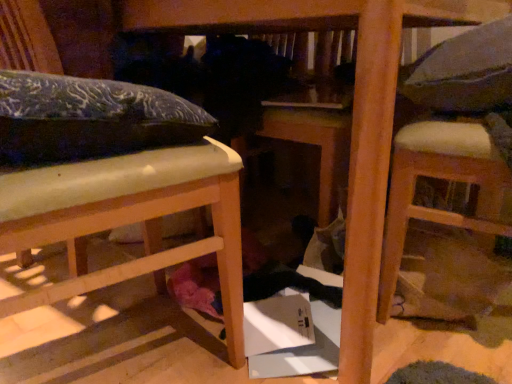
Identify the location of matte blue pillow at upper left. (89, 118).

Based on the photo, what is the approximate height of white padded chair at right, the 2th furniture viewed from the left?

white padded chair at right, the 2th furniture viewed from the left, is 27.96 inches in height.

What is the approximate height of matte wood bed at left, the 2th furniture when ordered from right to left?

It is 70.19 centimeters.

Find the location of `matte blue pillow at upper left`. matte blue pillow at upper left is located at coordinates (89, 118).

Between white padded chair at right, the 2th furniture viewed from the left, and matte wood bed at left, the 2th furniture when ordered from right to left, which one has smaller size?

white padded chair at right, the 2th furniture viewed from the left, is smaller.

From the image's perspective, would you say white padded chair at right, marked as the 1th furniture in a right-to-left arrangement, is positioned over matte wood bed at left, the first furniture positioned from the left?

Yes.

Is white padded chair at right, the 2th furniture viewed from the left, facing towards matte wood bed at left, the 2th furniture when ordered from right to left?

No, white padded chair at right, the 2th furniture viewed from the left, is not facing towards matte wood bed at left, the 2th furniture when ordered from right to left.

Is white padded chair at right, marked as the 1th furniture in a right-to-left arrangement, directly adjacent to matte wood bed at left, the first furniture positioned from the left?

white padded chair at right, marked as the 1th furniture in a right-to-left arrangement, and matte wood bed at left, the first furniture positioned from the left, are not in contact.

How many degrees apart are the facing directions of matte blue pillow at upper left and matte wood bed at left, the first furniture positioned from the left?

94.8 degrees separate the facing orientations of matte blue pillow at upper left and matte wood bed at left, the first furniture positioned from the left.

Locate an element on the screen. leftover that is above the matte wood bed at left, the 2th furniture when ordered from right to left (from the image's perspective) is located at coordinates (89, 118).

From a real-world perspective, is matte blue pillow at upper left positioned above or below matte wood bed at left, the 2th furniture when ordered from right to left?

Clearly, from a real-world perspective, matte blue pillow at upper left is above matte wood bed at left, the 2th furniture when ordered from right to left.

Between matte blue pillow at upper left and matte wood bed at left, the 2th furniture when ordered from right to left, which one has smaller width?

With smaller width is matte blue pillow at upper left.

Could you tell me if matte wood bed at left, the first furniture positioned from the left, is facing gray fabric pillow at upper right?

Yes.

Looking at this image, which object is wider, matte wood bed at left, the 2th furniture when ordered from right to left, or gray fabric pillow at upper right?

matte wood bed at left, the 2th furniture when ordered from right to left, is wider.

Between matte wood bed at left, the 2th furniture when ordered from right to left, and gray fabric pillow at upper right, which one has less height?

With less height is gray fabric pillow at upper right.

Is there a large distance between matte wood bed at left, the 2th furniture when ordered from right to left, and gray fabric pillow at upper right?

That's not correct — matte wood bed at left, the 2th furniture when ordered from right to left, is a little close to gray fabric pillow at upper right.

Does matte blue pillow at upper left appear on the right side of gray fabric pillow at upper right?

In fact, matte blue pillow at upper left is to the left of gray fabric pillow at upper right.

In the image, is matte blue pillow at upper left positioned in front of or behind gray fabric pillow at upper right?

matte blue pillow at upper left is in front of gray fabric pillow at upper right.

Is matte blue pillow at upper left turned away from gray fabric pillow at upper right?

That's not correct — matte blue pillow at upper left is not looking away from gray fabric pillow at upper right.

In terms of width, does matte blue pillow at upper left look wider or thinner when compared to gray fabric pillow at upper right?

matte blue pillow at upper left is wider than gray fabric pillow at upper right.

Are matte wood bed at left, the first furniture positioned from the left, and matte blue pillow at upper left located far from each other?

No, matte wood bed at left, the first furniture positioned from the left, is not far from matte blue pillow at upper left.

From the image's perspective, which one is positioned lower, matte wood bed at left, the first furniture positioned from the left, or matte blue pillow at upper left?

From the image's view, matte wood bed at left, the first furniture positioned from the left, is below.

Does matte wood bed at left, the 2th furniture when ordered from right to left, turn towards matte blue pillow at upper left?

Yes, matte wood bed at left, the 2th furniture when ordered from right to left, is oriented towards matte blue pillow at upper left.

Locate an element on the screen. This screenshot has width=512, height=384. furniture on the left of matte blue pillow at upper left is located at coordinates (114, 179).

How different are the orientations of white padded chair at right, the 2th furniture viewed from the left, and gray fabric pillow at upper right in degrees?

The facing directions of white padded chair at right, the 2th furniture viewed from the left, and gray fabric pillow at upper right are 6.39 degrees apart.

Is point (471, 144) farther from camera compared to point (405, 93)?

No.

In the scene shown: Between white padded chair at right, marked as the 1th furniture in a right-to-left arrangement, and gray fabric pillow at upper right, which one has smaller size?

gray fabric pillow at upper right is smaller.

Is white padded chair at right, the 2th furniture viewed from the left, at the left side of gray fabric pillow at upper right?

In fact, white padded chair at right, the 2th furniture viewed from the left, is to the right of gray fabric pillow at upper right.

Is white padded chair at right, marked as the 1th furniture in a right-to-left arrangement, inside or outside of matte blue pillow at upper left?

white padded chair at right, marked as the 1th furniture in a right-to-left arrangement, is outside matte blue pillow at upper left.

How many degrees apart are the facing directions of white padded chair at right, marked as the 1th furniture in a right-to-left arrangement, and matte blue pillow at upper left?

161 degrees.

You are a GUI agent. You are given a task and a screenshot of the screen. Output one action in this format:
    pyautogui.click(x=<x>, y=<y>)
    Task: Click on the leftover to the left of white padded chair at right, marked as the 1th furniture in a right-to-left arrangement
    
    Given the screenshot: What is the action you would take?
    pyautogui.click(x=89, y=118)

Is white padded chair at right, the 2th furniture viewed from the left, in front of or behind matte blue pillow at upper left in the image?

In the image, white padded chair at right, the 2th furniture viewed from the left, appears behind matte blue pillow at upper left.

Image resolution: width=512 pixels, height=384 pixels. Find the location of `furniture in front of the white padded chair at right, the 2th furniture viewed from the left`. furniture in front of the white padded chair at right, the 2th furniture viewed from the left is located at coordinates (114, 179).

The image size is (512, 384). There is a matte wood bed at left, the first furniture positioned from the left. In order to click on leftover above it (from a real-world perspective) in this screenshot , I will do click(x=89, y=118).

Based on their spatial positions, is matte blue pillow at upper left or gray fabric pillow at upper right closer to white padded chair at right, the 2th furniture viewed from the left?

Based on the image, gray fabric pillow at upper right appears to be nearer to white padded chair at right, the 2th furniture viewed from the left.

From the picture: Estimate the real-world distances between objects in this image. Which object is closer to matte blue pillow at upper left, white padded chair at right, the 2th furniture viewed from the left, or gray fabric pillow at upper right?

The object closer to matte blue pillow at upper left is white padded chair at right, the 2th furniture viewed from the left.

Estimate the real-world distances between objects in this image. Which object is closer to matte wood bed at left, the 2th furniture when ordered from right to left, white padded chair at right, marked as the 1th furniture in a right-to-left arrangement, or matte blue pillow at upper left?

matte blue pillow at upper left lies closer to matte wood bed at left, the 2th furniture when ordered from right to left, than the other object.

Looking at the image, which one is located closer to white padded chair at right, the 2th furniture viewed from the left, matte wood bed at left, the first furniture positioned from the left, or gray fabric pillow at upper right?

Among the two, gray fabric pillow at upper right is located nearer to white padded chair at right, the 2th furniture viewed from the left.

Which object lies further to the anchor point gray fabric pillow at upper right, matte blue pillow at upper left or white padded chair at right, marked as the 1th furniture in a right-to-left arrangement?

The object further to gray fabric pillow at upper right is matte blue pillow at upper left.

Considering their positions, is gray fabric pillow at upper right positioned further to matte blue pillow at upper left than white padded chair at right, the 2th furniture viewed from the left?

Among the two, gray fabric pillow at upper right is located further to matte blue pillow at upper left.

From the image, which object appears to be nearer to matte blue pillow at upper left, white padded chair at right, the 2th furniture viewed from the left, or matte wood bed at left, the 2th furniture when ordered from right to left?

matte wood bed at left, the 2th furniture when ordered from right to left.

From the image, which object appears to be farther from gray fabric pillow at upper right, white padded chair at right, the 2th furniture viewed from the left, or matte wood bed at left, the 2th furniture when ordered from right to left?

matte wood bed at left, the 2th furniture when ordered from right to left, is further to gray fabric pillow at upper right.

In order to click on leftover located between matte wood bed at left, the first furniture positioned from the left, and white padded chair at right, the 2th furniture viewed from the left, in the left-right direction in this screenshot , I will do `click(89, 118)`.

Locate an element on the screen. The height and width of the screenshot is (384, 512). leftover between matte wood bed at left, the first furniture positioned from the left, and gray fabric pillow at upper right, in the horizontal direction is located at coordinates (89, 118).

You are a GUI agent. You are given a task and a screenshot of the screen. Output one action in this format:
    pyautogui.click(x=<x>, y=<y>)
    Task: Click on the pillow between matte wood bed at left, the first furniture positioned from the left, and white padded chair at right, marked as the 1th furniture in a right-to-left arrangement
    Image resolution: width=512 pixels, height=384 pixels.
    Given the screenshot: What is the action you would take?
    pyautogui.click(x=464, y=71)

You are a GUI agent. You are given a task and a screenshot of the screen. Output one action in this format:
    pyautogui.click(x=<x>, y=<y>)
    Task: Click on the pillow situated between matte blue pillow at upper left and white padded chair at right, the 2th furniture viewed from the left, from left to right
    This screenshot has height=384, width=512.
    Given the screenshot: What is the action you would take?
    pyautogui.click(x=464, y=71)